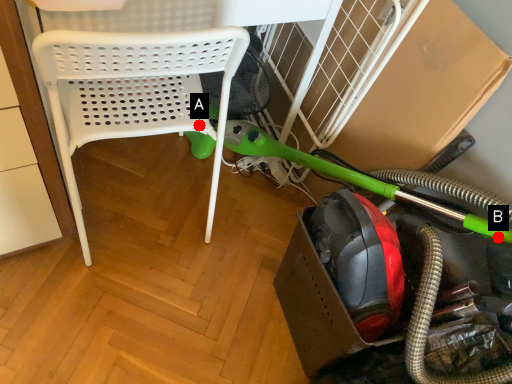
Question: Two points are circled on the image, labeled by A and B beside each circle. Which point is closer to the camera?

Choices:
 (A) A is closer
 (B) B is closer

Answer: (B)